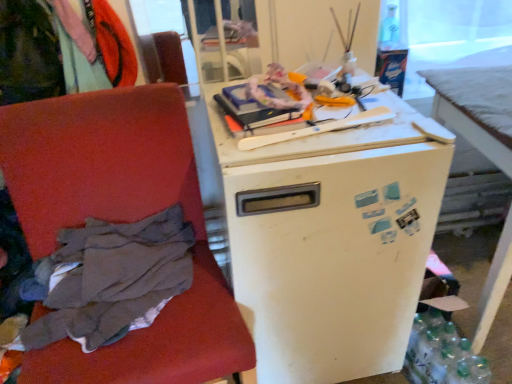
The width and height of the screenshot is (512, 384). Identify the location of vacant area on top of clear plastic bottles at lower right (from a real-world perspective). (439, 335).